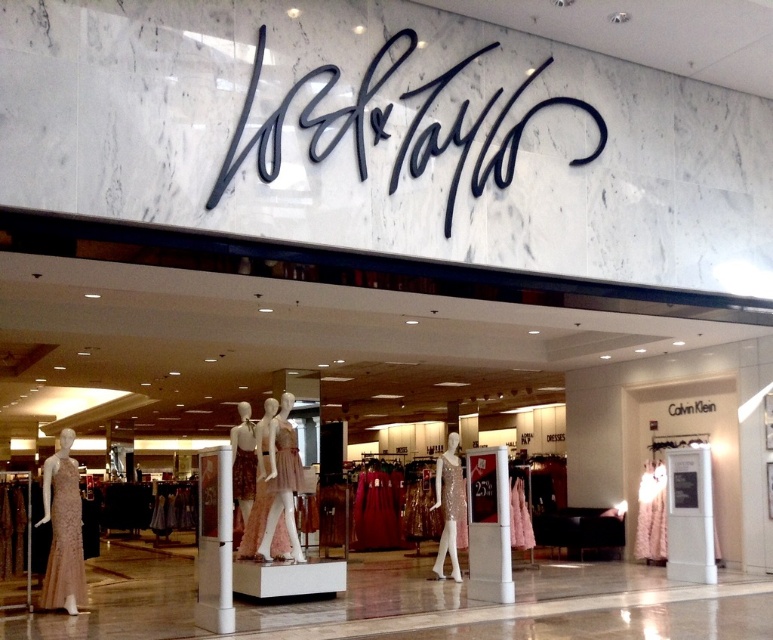
Question: Can you confirm if black script at center is smaller than pink sequined dress at center?

Choices:
 (A) yes
 (B) no

Answer: (B)

Question: Does sparkly gold dress at center have a greater width compared to pink sequined dress at center?

Choices:
 (A) no
 (B) yes

Answer: (A)

Question: Does shiny gold dress at right appear on the left side of pink sequined dress at center?

Choices:
 (A) yes
 (B) no

Answer: (B)

Question: Among these points, which one is nearest to the camera?

Choices:
 (A) (53, 550)
 (B) (458, 509)

Answer: (A)

Question: Which of the following is the closest to the observer?

Choices:
 (A) (520, 529)
 (B) (43, 497)

Answer: (B)

Question: Which of the following is the closest to the observer?

Choices:
 (A) (455, 490)
 (B) (591, 108)
 (C) (520, 518)
 (D) (72, 492)

Answer: (D)